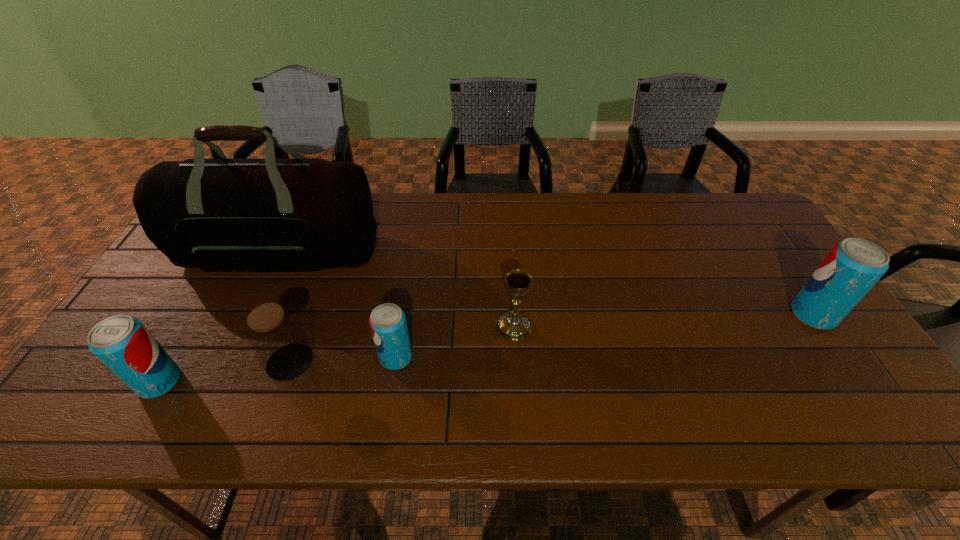
Where is `the leftmost soda can`? the leftmost soda can is located at coordinates (122, 343).

This screenshot has width=960, height=540. Identify the location of the shortest soda can. (388, 325).

Where is `the second soda can from right to left`? The width and height of the screenshot is (960, 540). the second soda can from right to left is located at coordinates click(x=388, y=325).

Locate an element on the screen. the rightmost soda can is located at coordinates (852, 267).

Identify the location of the farthest soda can. The width and height of the screenshot is (960, 540). (852, 267).

I want to click on chalice, so click(x=512, y=325).

Find the location of `duffel bag`. duffel bag is located at coordinates (305, 214).

You are a GUI agent. You are given a task and a screenshot of the screen. Output one action in this format:
    pyautogui.click(x=<x>, y=<y>)
    Task: Click on the farthest object
    The height and width of the screenshot is (540, 960).
    Given the screenshot: What is the action you would take?
    pyautogui.click(x=305, y=214)

Identify the location of jar. The width and height of the screenshot is (960, 540). (275, 336).

Where is `vacant region located on the right of the leftmost soda can`? vacant region located on the right of the leftmost soda can is located at coordinates (205, 382).